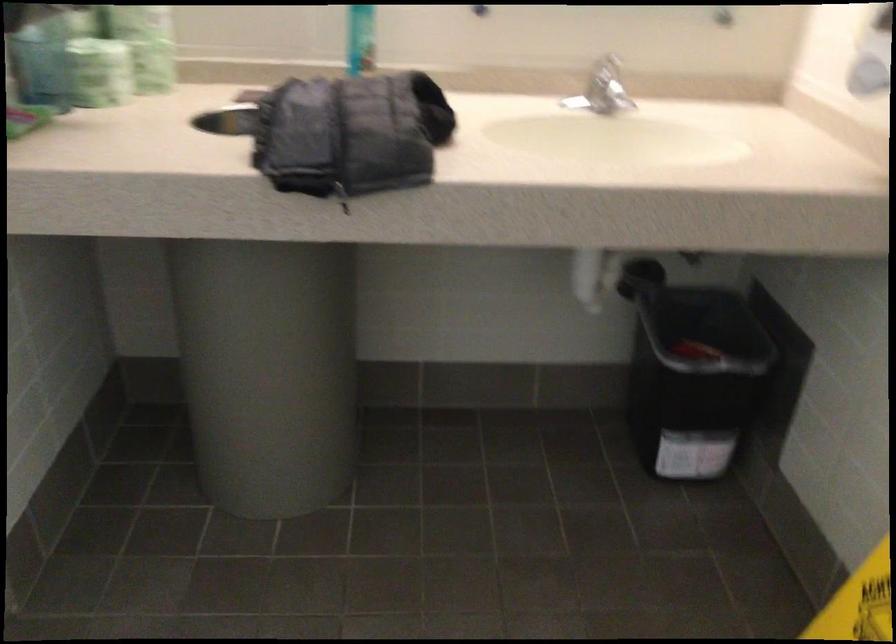
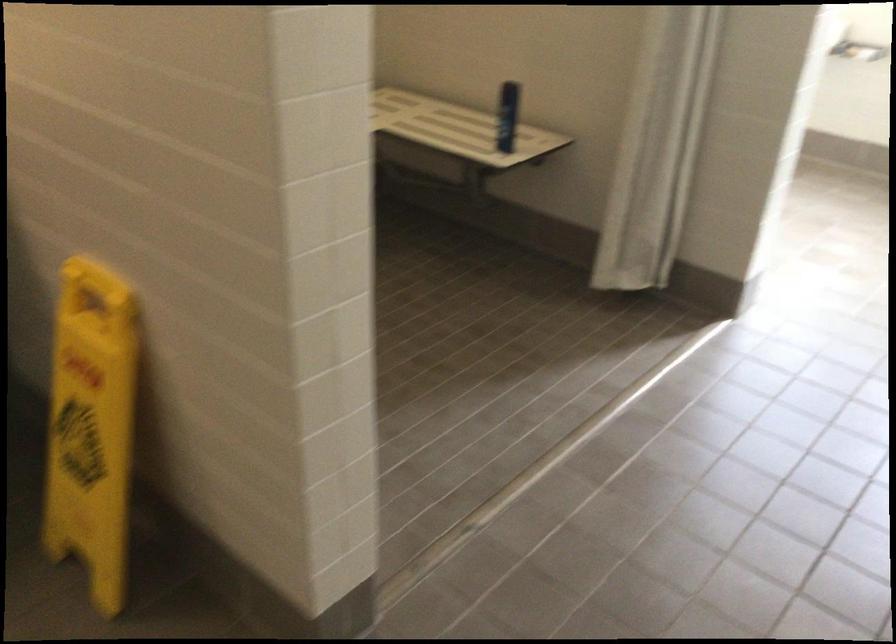
Question: The first image is from the beginning of the video and the second image is from the end. How did the camera likely rotate when shooting the video?

Choices:
 (A) Left
 (B) Right
 (C) Up
 (D) Down

Answer: (B)